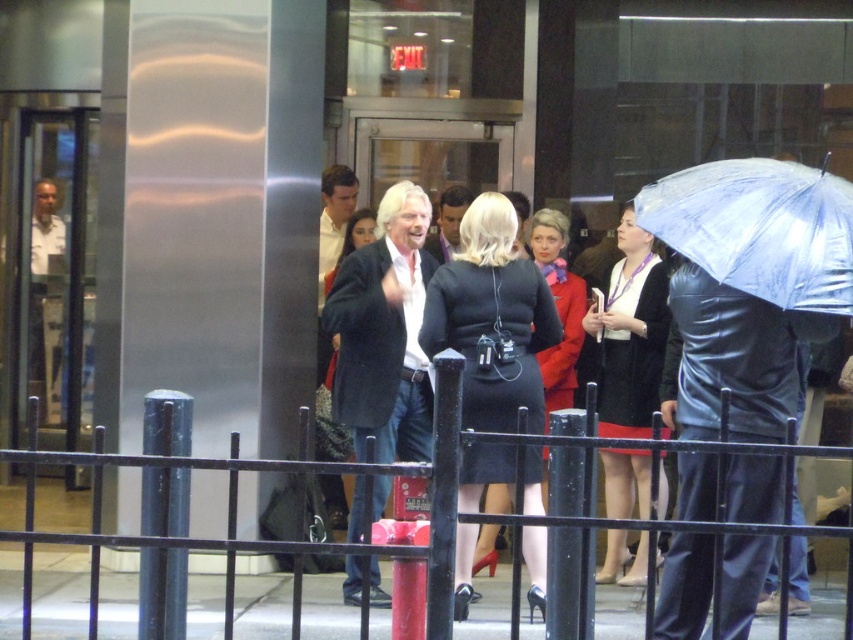
You are a photographer trying to capture the scene outside the building at night. You notice the black fabric dress at center and the black metal fence at lower center. Which object would appear smaller in your photo?

The black fabric dress at center would appear smaller in the photo because it has a smaller size compared to the black metal fence at lower center.

You are standing at the entrance of the building and want to walk towards the black metal fence at lower center. In which direction should you move relative to your current position?

The black metal fence at lower center is located at point 0.850 on the x and 0.383 on the y coordinates. Since you are at the entrance, you should move towards the lower center direction to reach it.